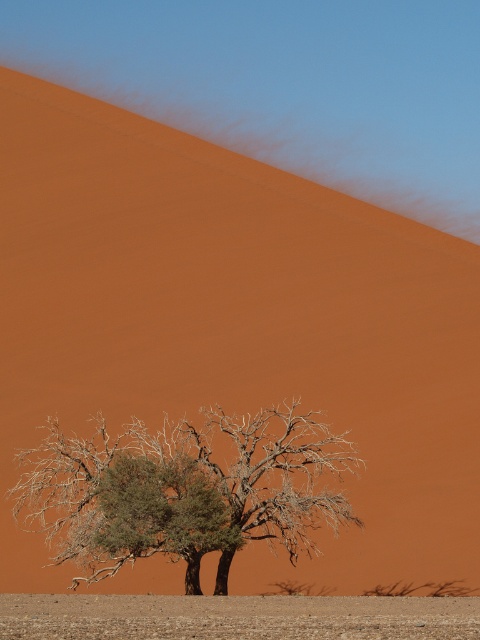
You are a hiker who wants to take a photo of the green leafy tree at lower center and the brown sandy ground at lower center. Which object should you focus on first if you want to capture both in a single shot without moving the camera?

You should focus on the green leafy tree at lower center first because it is closer to the camera than the brown sandy ground at lower center, ensuring both are in focus when using depth of field.

You are a hiker who just arrived at the desert. You see the green leafy tree at lower center and the brown sandy ground at lower center. Which object is closer to you?

The green leafy tree at lower center is closer to you because the brown sandy ground at lower center is behind it.

You are a hiker who wants to take a photo of the green leafy tree at lower center. To get the best shot, you need to position yourself so that the tree is framed against the sky. Based on the scene description, where should you stand relative to the brown sandy ground at lower center?

You should stand behind the brown sandy ground at lower center so that the green leafy tree at lower center is framed against the sky. Since the tree is above the ground, positioning yourself behind the ground will allow the tree to be in the foreground with the sky as the background.